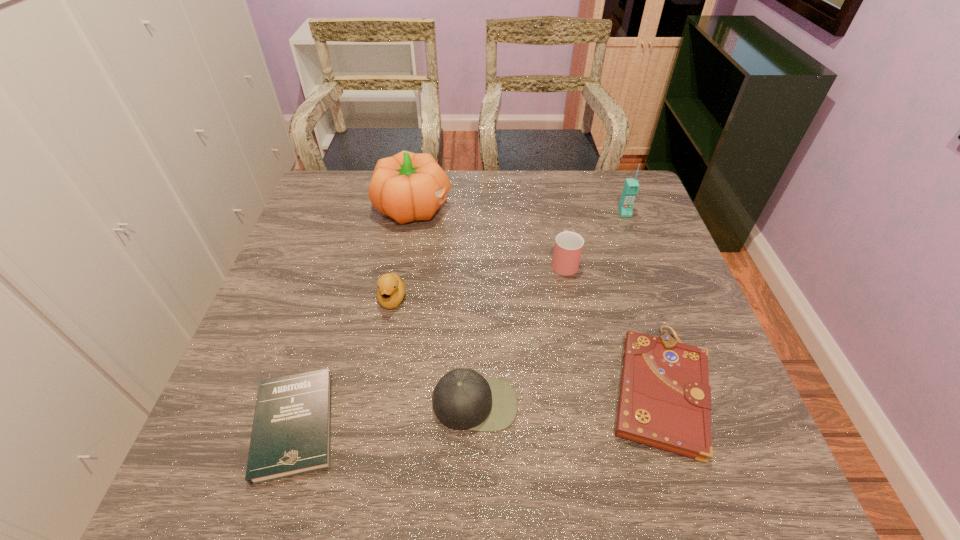
Identify the location of object that is at the left edge. Image resolution: width=960 pixels, height=540 pixels. (291, 435).

Where is `cellular telephone situated at the right edge`? This screenshot has height=540, width=960. cellular telephone situated at the right edge is located at coordinates (631, 186).

Image resolution: width=960 pixels, height=540 pixels. Identify the location of notebook located in the right edge section of the desktop. (665, 399).

Find the location of a particular element. The image size is (960, 540). object that is at the near left corner is located at coordinates [x=291, y=435].

Find the location of a particular element. This screenshot has height=540, width=960. object that is at the far right corner is located at coordinates (631, 186).

Locate an element on the screen. The height and width of the screenshot is (540, 960). object present at the near right corner is located at coordinates (665, 399).

The height and width of the screenshot is (540, 960). What are the coordinates of `vacant position at the far edge of the desktop` in the screenshot? It's located at (448, 207).

This screenshot has width=960, height=540. In the image, there is a desktop. In order to click on vacant space at the near edge in this screenshot , I will do (x=474, y=467).

This screenshot has height=540, width=960. Identify the location of free space at the left edge. (320, 242).

What are the coordinates of `vacant space at the right edge` in the screenshot? It's located at (680, 332).